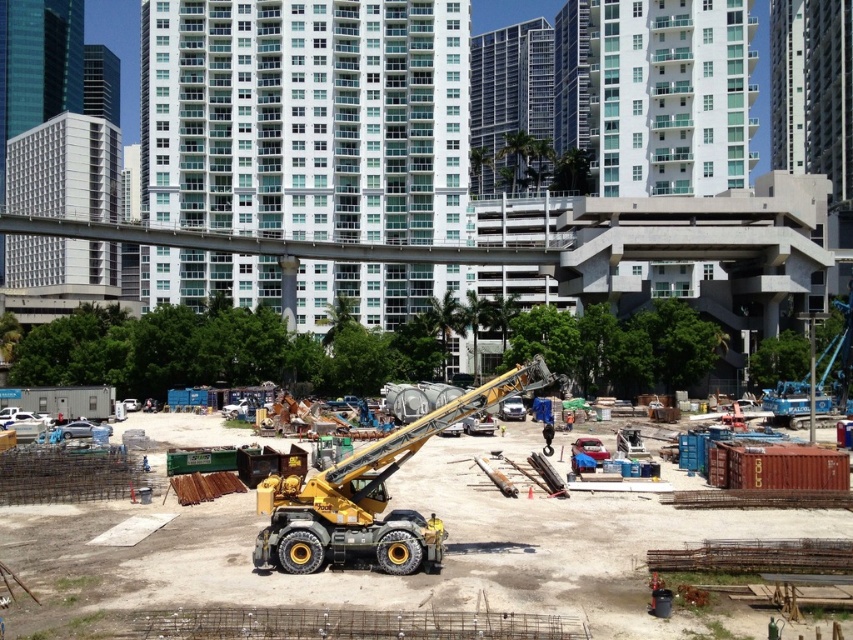
Question: Does yellow metallic crane at center have a lesser width compared to yellow metallic excavator at center?

Choices:
 (A) yes
 (B) no

Answer: (B)

Question: Which point is closer to the camera?

Choices:
 (A) yellow metallic excavator at center
 (B) yellow metallic crane at center

Answer: (B)

Question: Does yellow metallic crane at center appear under yellow metallic excavator at center?

Choices:
 (A) no
 (B) yes

Answer: (B)

Question: Which of the following is the closest to the observer?

Choices:
 (A) (277, 509)
 (B) (816, 532)

Answer: (A)

Question: Does yellow metallic crane at center have a lesser width compared to yellow metallic excavator at center?

Choices:
 (A) yes
 (B) no

Answer: (B)